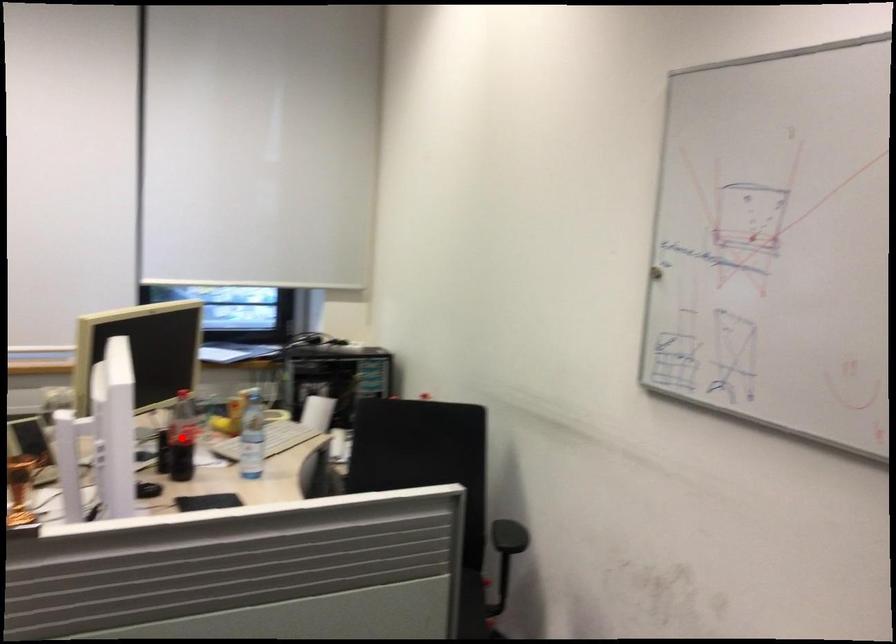
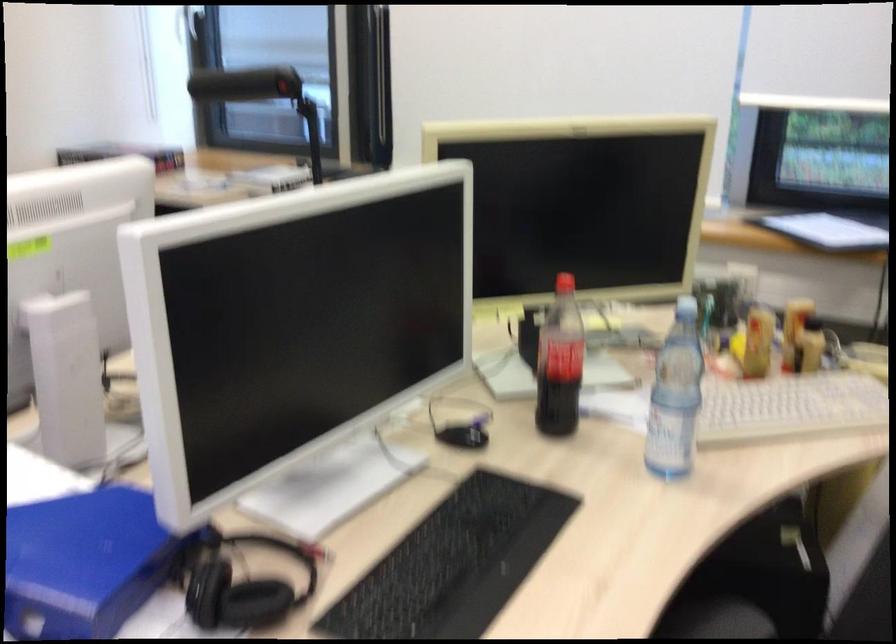
Locate, in the second image, the point that corresponds to the highlighted location in the first image.

(581, 371)